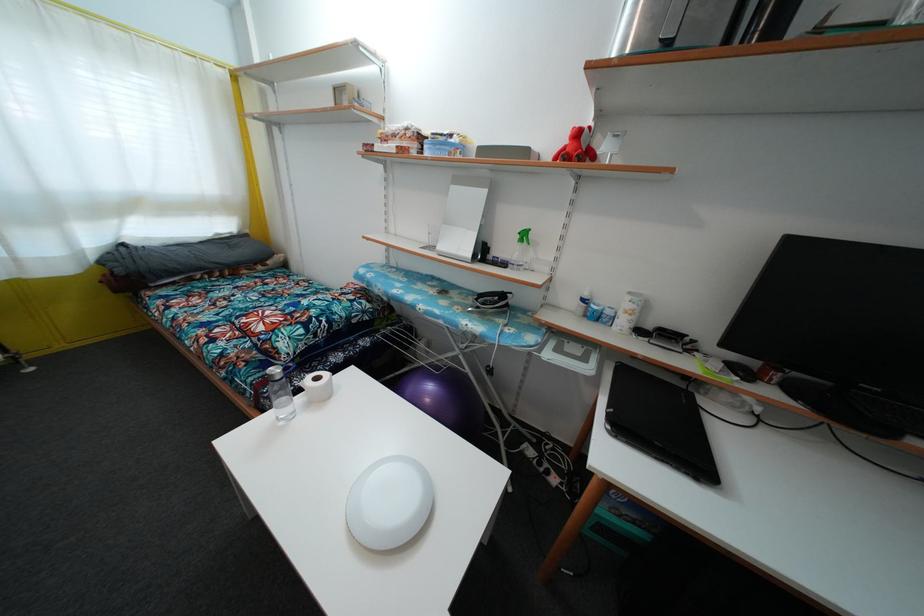
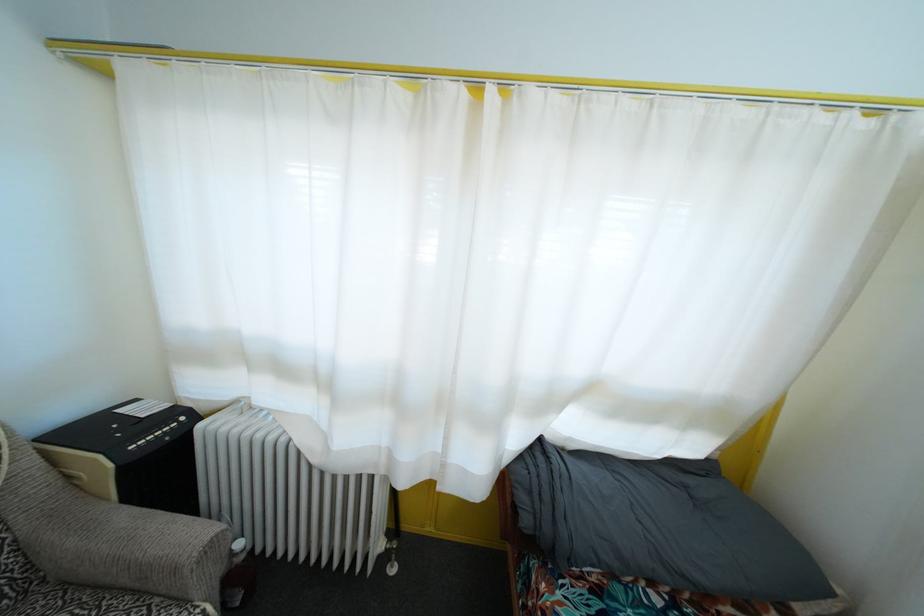
Where in the second image is the point corresponding to point 123,278 from the first image?

(529, 528)